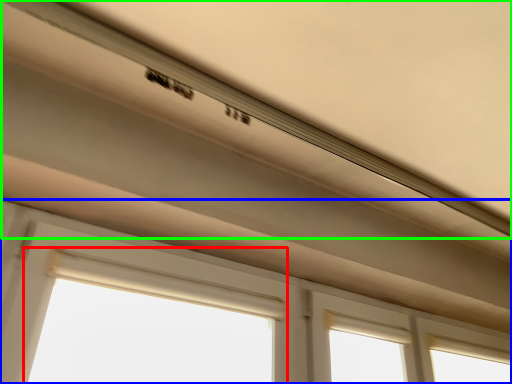
Question: Based on their relative distances, which object is farther from bay window (highlighted by a red box)? Choose from window (highlighted by a blue box) and exhaust hood (highlighted by a green box).

Choices:
 (A) window
 (B) exhaust hood

Answer: (B)